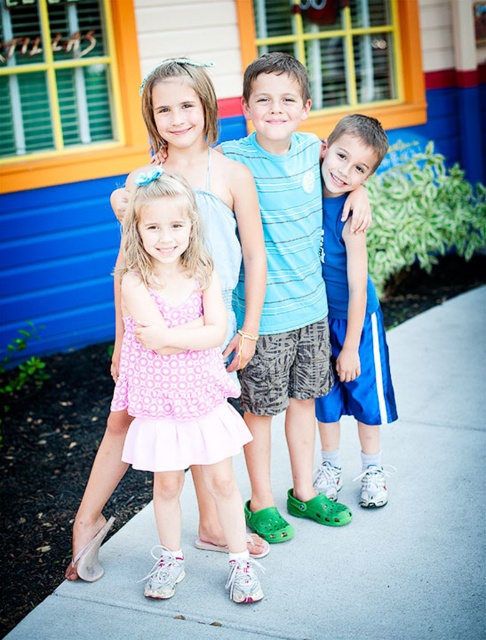
You are a photographer trying to capture the blue athletic shorts at center and the gray concrete pavement at center in the same frame. Based on their positions, which object is closer to the camera?

The blue athletic shorts at center are closer to the camera than the gray concrete pavement at center because the pavement is positioned under the shorts.

You are standing at the point labeled as point (279, 529) and want to move towards the point labeled as point (447, 308). Considering the spatial relationship between these two points, will you be moving forward or backward relative to your current position?

Since point (447, 308) is behind point (279, 529), moving towards it would mean moving backward relative to your current position at point (279, 529).

You are a photographer trying to capture the children in the image. You notice the gray concrete pavement at center and the blue athletic shorts at center. Which object is located to the left of the other?

The gray concrete pavement at center is positioned on the right side of blue athletic shorts at center, so the blue athletic shorts at center is to the left of the gray concrete pavement at center.